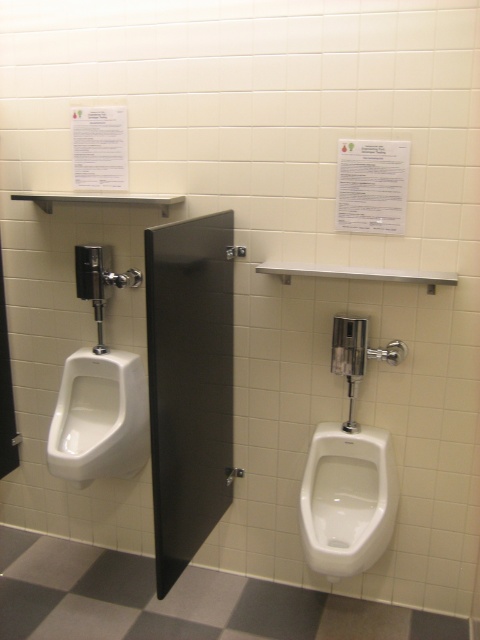
You are standing in front of the public restroom and want to locate the white glossy urinal at lower right. According to the coordinate system where the bottom left corner is the origin, can you tell me its position?

The white glossy urinal at lower right is located at point (348,499).